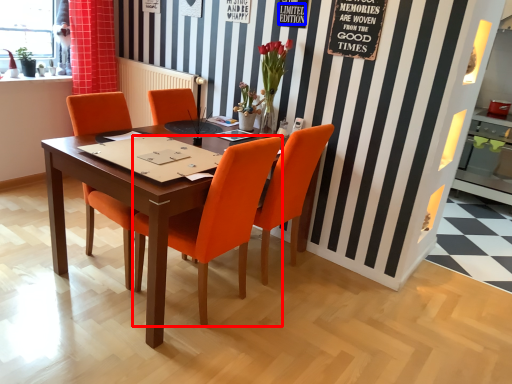
Question: Among these objects, which one is nearest to the camera, chair (highlighted by a red box) or writing (highlighted by a blue box)?

Choices:
 (A) chair
 (B) writing

Answer: (A)